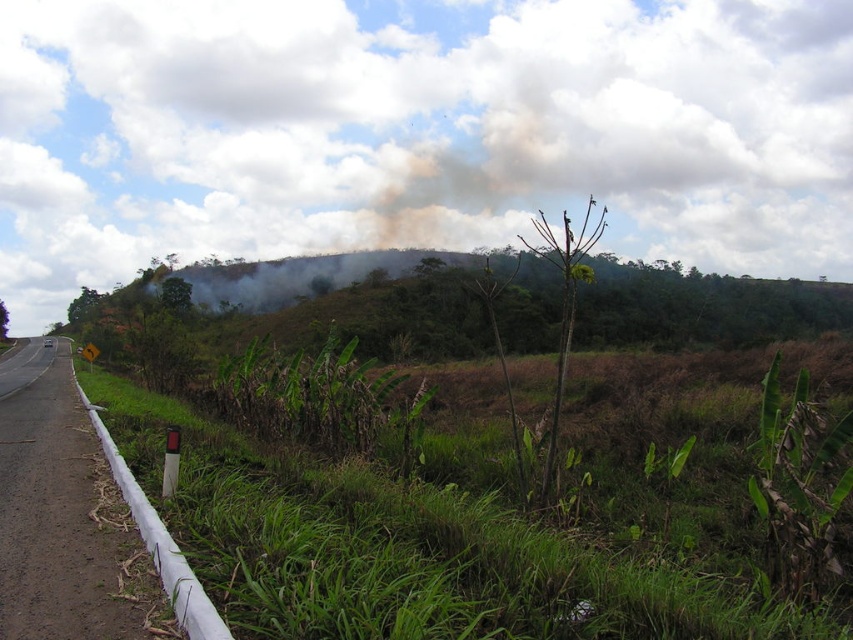
Between green leafy vegetation at center and white plastic barrier at left, which one has less height?

white plastic barrier at left is shorter.

Does point (341, 346) come behind point (42, 445)?

Yes.

The width and height of the screenshot is (853, 640). I want to click on green leafy vegetation at center, so click(473, 474).

I want to click on green leafy vegetation at center, so click(x=473, y=474).